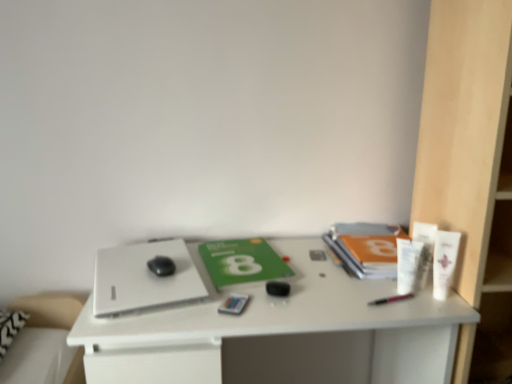
Question: Is white plastic tube at right, which is the 2th toiletry in right-to-left order, bigger or smaller than white matte tube at upper right, which is the 3th toiletry from left to right?

Choices:
 (A) big
 (B) small

Answer: (B)

Question: In terms of width, does white plastic tube at right, which is the 2th toiletry in right-to-left order, look wider or thinner when compared to white matte tube at upper right, which is the 3th toiletry from left to right?

Choices:
 (A) thin
 (B) wide

Answer: (A)

Question: Based on their relative distances, which object is farther from the white matte tube at upper right, the 1th toiletry in the right-to-left sequence?

Choices:
 (A) white plastic tube at right, the third toiletry positioned from the right
 (B) white plastic bookshelf at right
 (C) matte plastic card at center, which appears as the first stationery when viewed from the left
 (D) black matte mouse at center
 (E) orange matte book at right, the first paperback book when ordered from right to left

Answer: (D)

Question: Based on their relative distances, which object is farther from the white matte laptop at left?

Choices:
 (A) matte plastic card at center, which appears as the first stationery when viewed from the left
 (B) black matte mouse at center
 (C) black plastic pen at center, arranged as the 1th stationery when viewed from the right
 (D) orange matte book at right, the first paperback book when ordered from right to left
 (E) green matte paperback book at center, the second paperback book in the right-to-left sequence

Answer: (C)